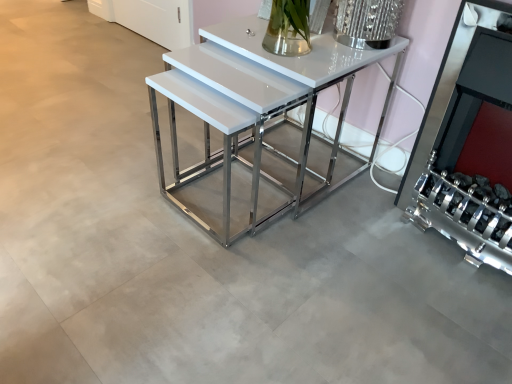
This screenshot has height=384, width=512. I want to click on free space on the front side of white glossy table at center, so click(x=273, y=287).